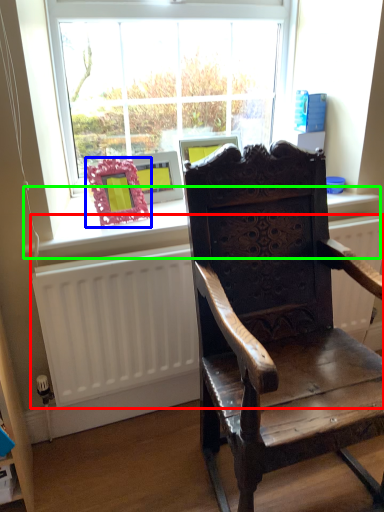
Question: Estimate the real-world distances between objects in this image. Which object is farther from radiator (highlighted by a red box), picture frame (highlighted by a blue box) or window sill (highlighted by a green box)?

Choices:
 (A) picture frame
 (B) window sill

Answer: (A)